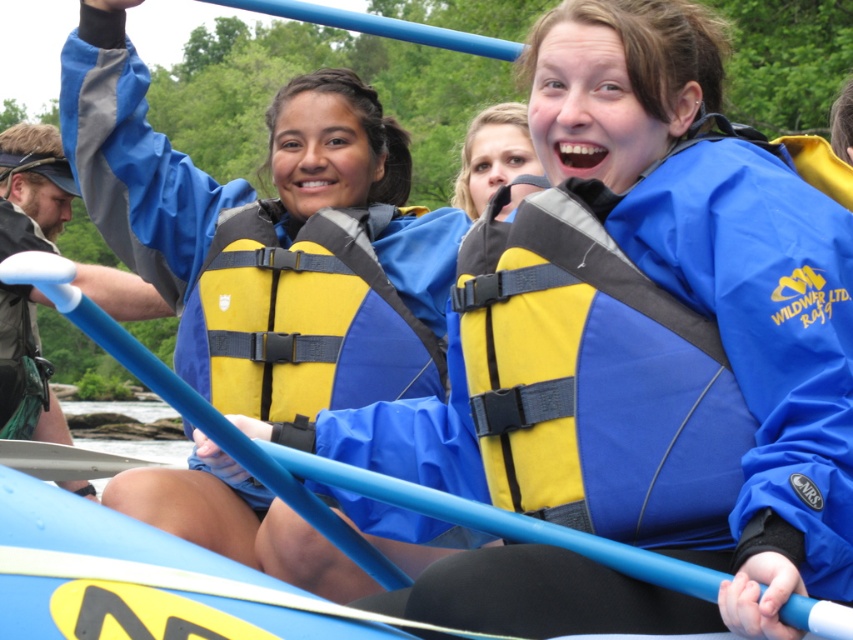
You are a safety inspector checking the gear of the rafting group. You need to ensure that the matte blue life vest at upper center and the metallic blue paddle at center are properly sized for their intended use. Which object has a smaller width?

The matte blue life vest at upper center is thinner than the metallic blue paddle at center, so the matte blue life vest at upper center has a smaller width.